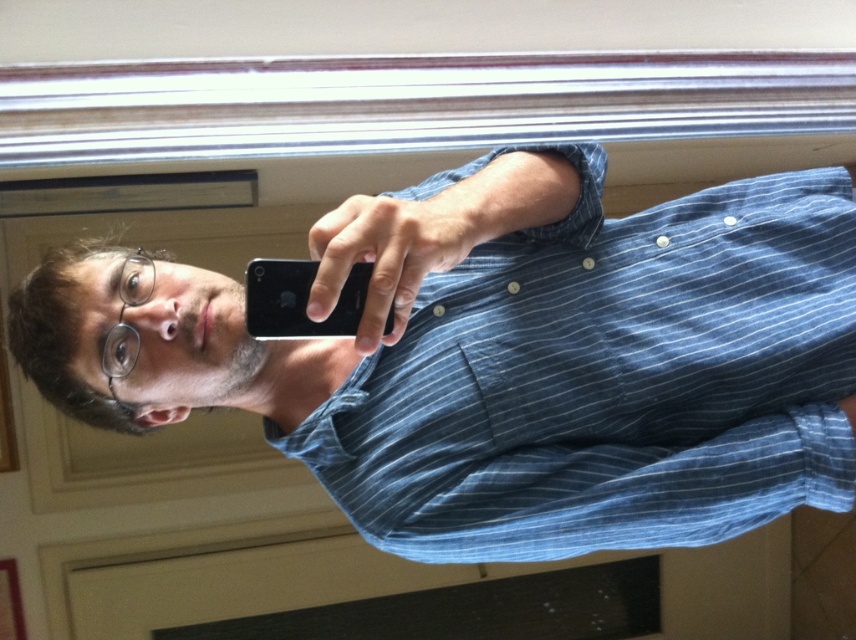
Question: Which point is farther to the camera?

Choices:
 (A) black matte smartphone at center
 (B) blue striped shirt at center

Answer: (B)

Question: Can you confirm if blue striped shirt at center is positioned below black matte smartphone at center?

Choices:
 (A) no
 (B) yes

Answer: (A)

Question: Is blue striped shirt at center closer to camera compared to black matte smartphone at center?

Choices:
 (A) yes
 (B) no

Answer: (B)

Question: Can you confirm if blue striped shirt at center is positioned to the left of black matte smartphone at center?

Choices:
 (A) no
 (B) yes

Answer: (A)

Question: Which point appears farthest from the camera in this image?

Choices:
 (A) (299, 280)
 (B) (849, 365)

Answer: (B)